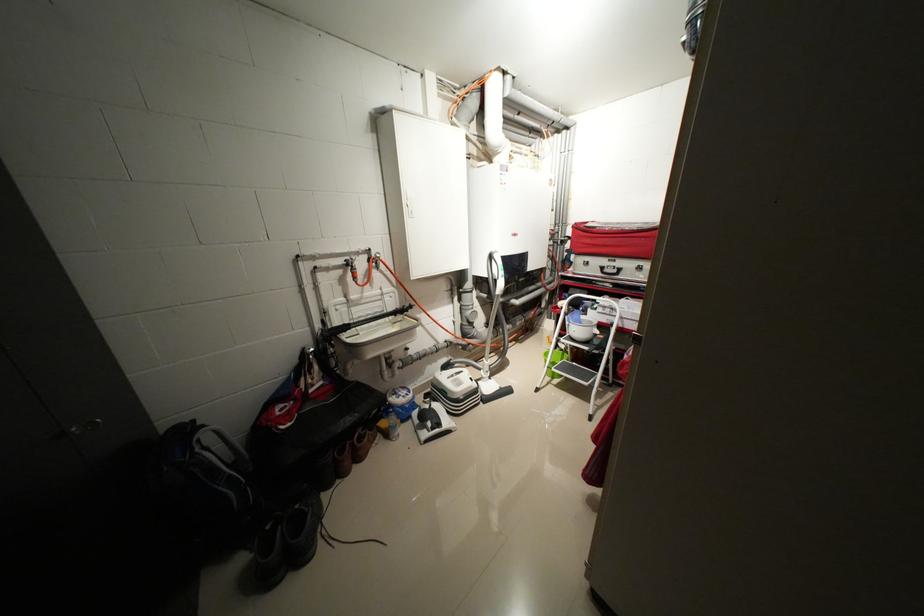
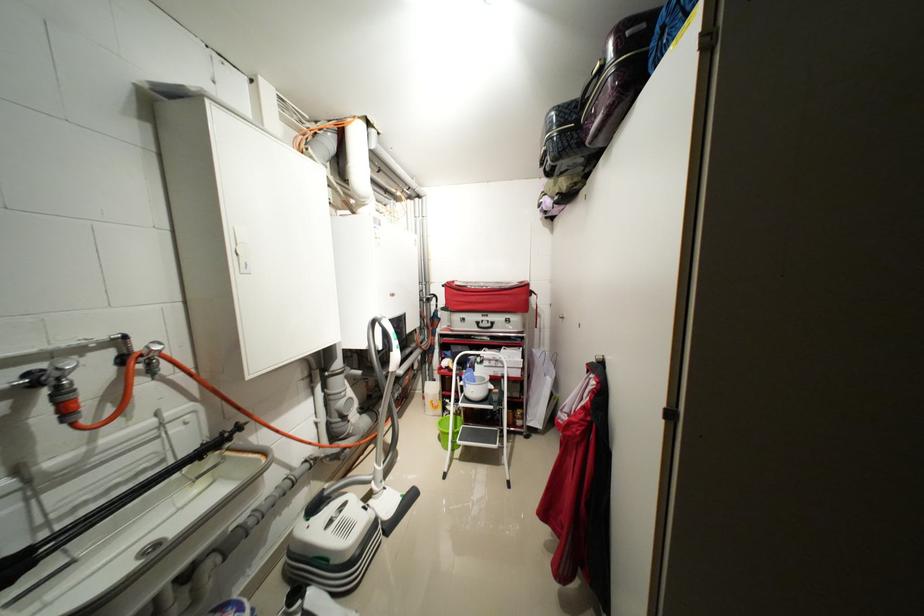
Question: The camera is either moving clockwise (left) or counter-clockwise (right) around the object. The first image is from the beginning of the video and the second image is from the end. Is the camera moving left or right when shooting the video?

Choices:
 (A) Left
 (B) Right

Answer: (A)